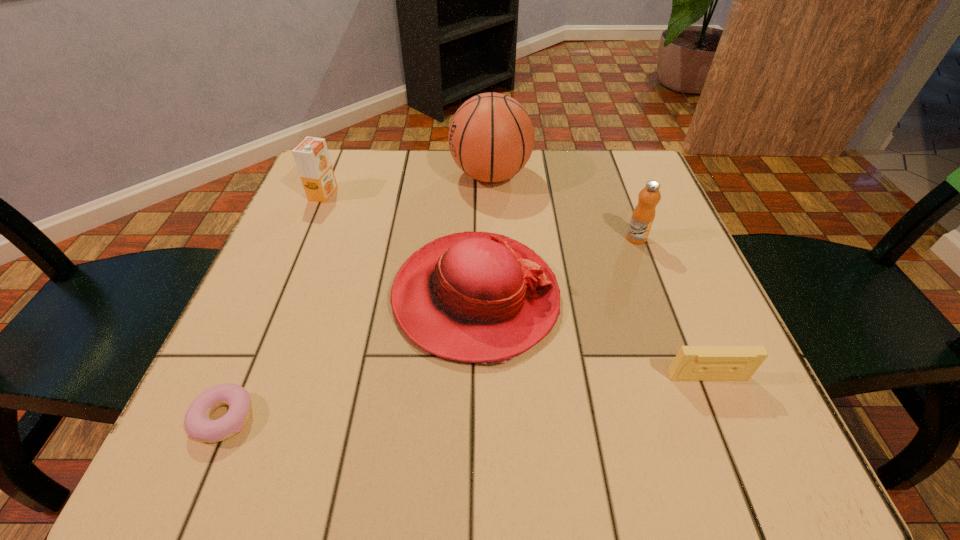
I want to click on doughnut that is at the left edge, so click(x=198, y=424).

Image resolution: width=960 pixels, height=540 pixels. What are the coordinates of `orange juice located in the right edge section of the desktop` in the screenshot? It's located at (643, 215).

Where is `videotape at the right edge`? The width and height of the screenshot is (960, 540). videotape at the right edge is located at coordinates (692, 363).

Locate an element on the screen. This screenshot has height=540, width=960. object present at the far left corner is located at coordinates (311, 155).

Where is `object positioned at the near left corner`? The image size is (960, 540). object positioned at the near left corner is located at coordinates (198, 424).

I want to click on free space at the far edge of the desktop, so click(572, 187).

Identify the location of vacant space at the near edge of the desktop. The width and height of the screenshot is (960, 540). (552, 438).

The height and width of the screenshot is (540, 960). In the image, there is a desktop. In order to click on free space at the left edge in this screenshot , I will do `click(279, 321)`.

This screenshot has height=540, width=960. Find the location of `free space at the right edge`. free space at the right edge is located at coordinates (612, 266).

You are a GUI agent. You are given a task and a screenshot of the screen. Output one action in this format:
    pyautogui.click(x=<x>, y=<y>)
    Task: Click on the free location at the far left corner
    This screenshot has width=960, height=540.
    Given the screenshot: What is the action you would take?
    pyautogui.click(x=359, y=158)